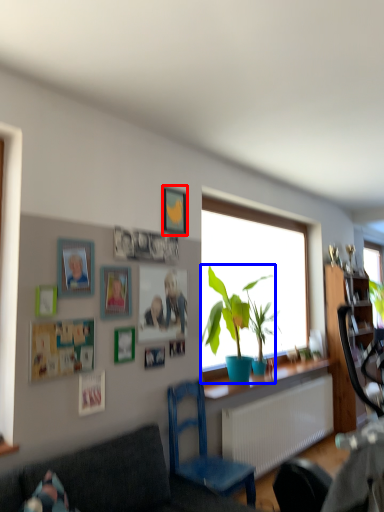
Question: Among these objects, which one is nearest to the camera, picture frame (highlighted by a red box) or houseplant (highlighted by a blue box)?

Choices:
 (A) picture frame
 (B) houseplant

Answer: (A)